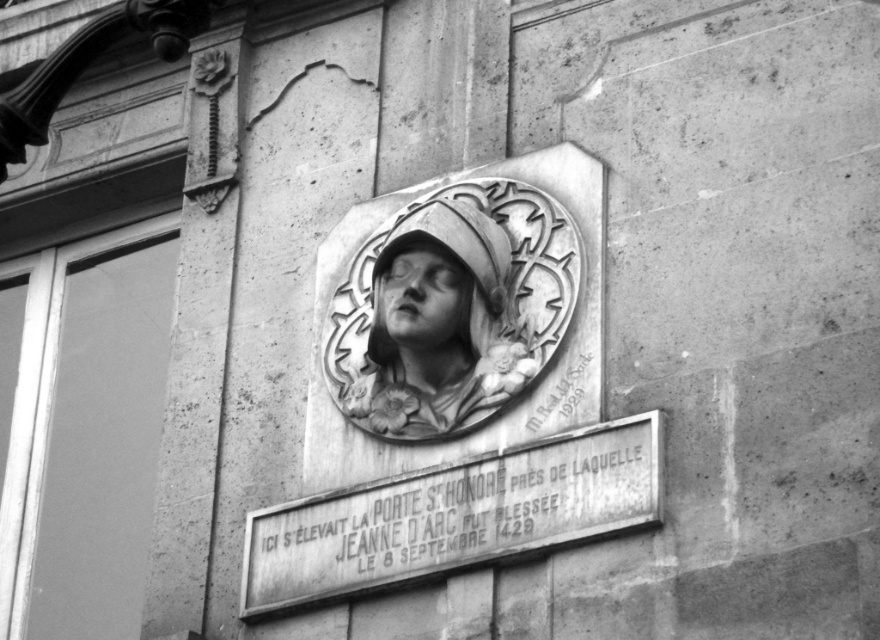
Question: Is white stone plaque at center bigger than matte stone face at center?

Choices:
 (A) no
 (B) yes

Answer: (B)

Question: Can you confirm if white marble bust at center is bigger than matte stone face at center?

Choices:
 (A) yes
 (B) no

Answer: (B)

Question: Which object appears closest to the camera in this image?

Choices:
 (A) matte stone face at center
 (B) white stone plaque at center
 (C) white marble bust at center

Answer: (B)

Question: Which point appears farthest from the camera in this image?

Choices:
 (A) (387, 330)
 (B) (390, 538)

Answer: (A)

Question: Is white marble bust at center further to camera compared to matte stone face at center?

Choices:
 (A) no
 (B) yes

Answer: (B)

Question: Which object appears farthest from the camera in this image?

Choices:
 (A) matte stone face at center
 (B) white stone plaque at center
 (C) white marble bust at center

Answer: (C)